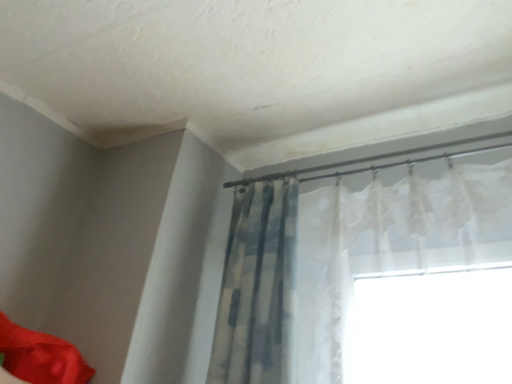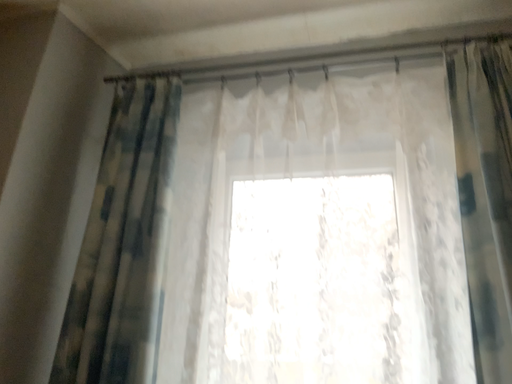
Question: Which way did the camera rotate in the video?

Choices:
 (A) rotated right
 (B) rotated left

Answer: (A)